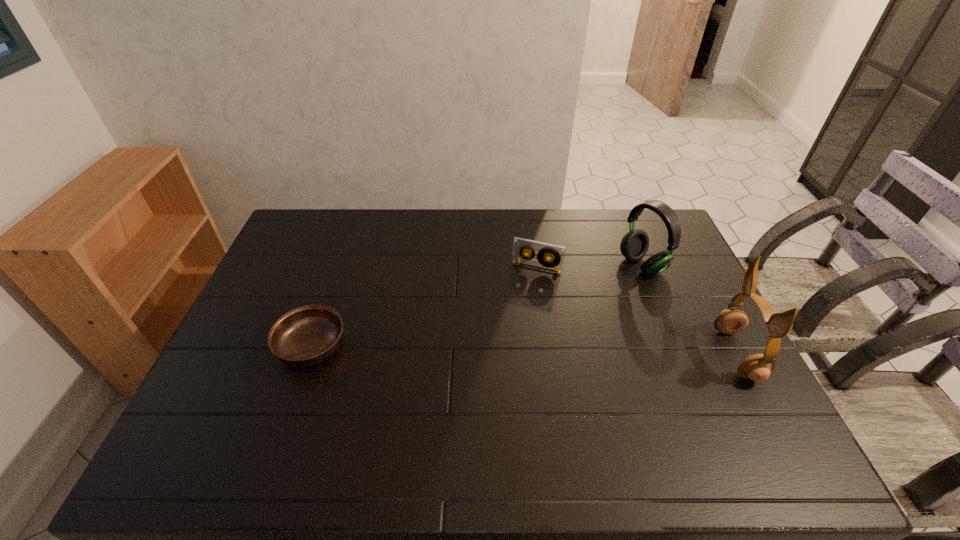
Where is `unoccupied position between the videotape and the earphone`? unoccupied position between the videotape and the earphone is located at coordinates (636, 311).

The height and width of the screenshot is (540, 960). What are the coordinates of `vacant space in between the soup bowl and the rightmost object` in the screenshot? It's located at (524, 350).

Locate an element on the screen. This screenshot has width=960, height=540. empty space between the second shortest object and the third shortest object is located at coordinates (589, 266).

Find the location of a particular element. The width and height of the screenshot is (960, 540). free spot between the headset and the leftmost object is located at coordinates (477, 306).

Where is `vacant space in between the soup bowl and the earphone`? vacant space in between the soup bowl and the earphone is located at coordinates (524, 350).

At what (x,y) coordinates should I click in order to perform the action: click on free space between the headset and the second shortest object. Please return your answer as a coordinate pair (x, y). This screenshot has height=540, width=960. Looking at the image, I should click on (589, 266).

Where is `vacant area between the headset and the second object from left to right`? The image size is (960, 540). vacant area between the headset and the second object from left to right is located at coordinates point(589,266).

Identify the location of object that is the closest to the third object from left to right. This screenshot has height=540, width=960. (757, 367).

The width and height of the screenshot is (960, 540). In order to click on object that can be found as the third closest to the headset in this screenshot , I will do `click(308, 335)`.

This screenshot has height=540, width=960. I want to click on blank area in the image that satisfies the following two spatial constraints: 1. on the front side of the rightmost object; 2. on the front-facing side of the second object from right to left, so click(678, 354).